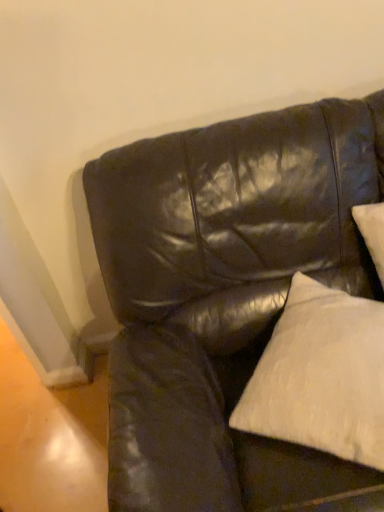
Question: Considering the positions of glossy leather couch at upper right and white cotton pillow at upper right in the image, is glossy leather couch at upper right taller or shorter than white cotton pillow at upper right?

Choices:
 (A) tall
 (B) short

Answer: (A)

Question: From a real-world perspective, is glossy leather couch at upper right above or below white cotton pillow at upper right?

Choices:
 (A) above
 (B) below

Answer: (B)

Question: Considering the positions of point (213, 503) and point (352, 312), is point (213, 503) closer or farther from the camera than point (352, 312)?

Choices:
 (A) farther
 (B) closer

Answer: (B)

Question: From a real-world perspective, relative to glossy leather couch at upper right, is white cotton pillow at upper right vertically above or below?

Choices:
 (A) above
 (B) below

Answer: (A)

Question: In terms of width, does white cotton pillow at upper right look wider or thinner when compared to glossy leather couch at upper right?

Choices:
 (A) wide
 (B) thin

Answer: (B)

Question: Is white cotton pillow at upper right spatially inside glossy leather couch at upper right, or outside of it?

Choices:
 (A) inside
 (B) outside

Answer: (A)

Question: Does point (296, 435) appear closer or farther from the camera than point (309, 486)?

Choices:
 (A) farther
 (B) closer

Answer: (A)